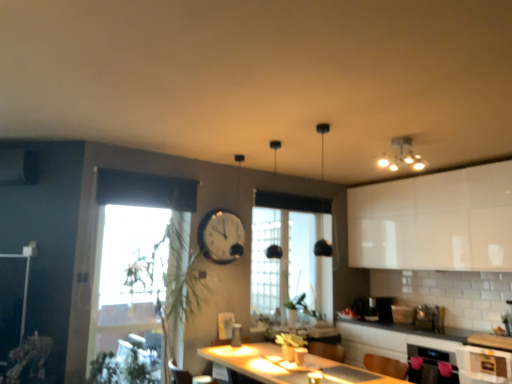
Question: Does clear glass window at center, which ranks as the second window in left-to-right order, turn towards transparent glass window at left, which is the 1th window from left to right?

Choices:
 (A) no
 (B) yes

Answer: (A)

Question: Is clear glass window at center, which ranks as the second window in left-to-right order, located outside transparent glass window at left, which is the 1th window from left to right?

Choices:
 (A) yes
 (B) no

Answer: (A)

Question: Considering the relative sizes of clear glass window at center, which is the 1th window from right to left, and transparent glass window at left, the 2th window viewed from the back, in the image provided, is clear glass window at center, which is the 1th window from right to left, smaller than transparent glass window at left, the 2th window viewed from the back,?

Choices:
 (A) no
 (B) yes

Answer: (B)

Question: Does clear glass window at center, marked as the 2th window in a front-to-back arrangement, lie behind transparent glass window at left, which is the 1th window from left to right?

Choices:
 (A) no
 (B) yes

Answer: (B)

Question: Does clear glass window at center, marked as the 2th window in a front-to-back arrangement, have a greater height compared to transparent glass window at left, which is counted as the 1th window, starting from the front?

Choices:
 (A) no
 (B) yes

Answer: (A)

Question: From a real-world perspective, is white glossy cabinet at lower right, positioned as the first cabinetry in bottom-to-top order, above or below matte white light fixture at upper right?

Choices:
 (A) below
 (B) above

Answer: (A)

Question: Considering the positions of point (481, 352) and point (410, 150), is point (481, 352) closer or farther from the camera than point (410, 150)?

Choices:
 (A) farther
 (B) closer

Answer: (B)

Question: Do you think white glossy cabinet at lower right, placed as the first cabinetry when sorted from front to back, is within matte white light fixture at upper right, or outside of it?

Choices:
 (A) outside
 (B) inside

Answer: (A)

Question: Is white glossy cabinet at lower right, placed as the first cabinetry when sorted from front to back, to the left or to the right of matte white light fixture at upper right in the image?

Choices:
 (A) right
 (B) left

Answer: (A)

Question: Relative to transparent glass window at left, which is the 1th window from left to right, is white glossy cabinet at upper right, marked as the 2th cabinetry in a front-to-back arrangement, in front or behind?

Choices:
 (A) behind
 (B) front

Answer: (A)

Question: Based on their sizes in the image, would you say white glossy cabinet at upper right, the first cabinetry in the back-to-front sequence, is bigger or smaller than transparent glass window at left, positioned as the 2th window in right-to-left order?

Choices:
 (A) small
 (B) big

Answer: (A)

Question: Is white glossy cabinet at upper right, marked as the 2th cabinetry in a front-to-back arrangement, wider or thinner than transparent glass window at left, which is the 1th window from left to right?

Choices:
 (A) thin
 (B) wide

Answer: (A)

Question: From the image's perspective, relative to transparent glass window at left, which is counted as the 1th window, starting from the front, is white glossy cabinet at upper right, marked as the 2th cabinetry in a front-to-back arrangement, above or below?

Choices:
 (A) above
 (B) below

Answer: (A)

Question: Looking at the image, does white glossy countertop at lower right seem bigger or smaller compared to transparent glass window at left, which is the 1th window from left to right?

Choices:
 (A) big
 (B) small

Answer: (B)

Question: From a real-world perspective, relative to transparent glass window at left, which is counted as the 1th window, starting from the front, is white glossy countertop at lower right vertically above or below?

Choices:
 (A) below
 (B) above

Answer: (A)